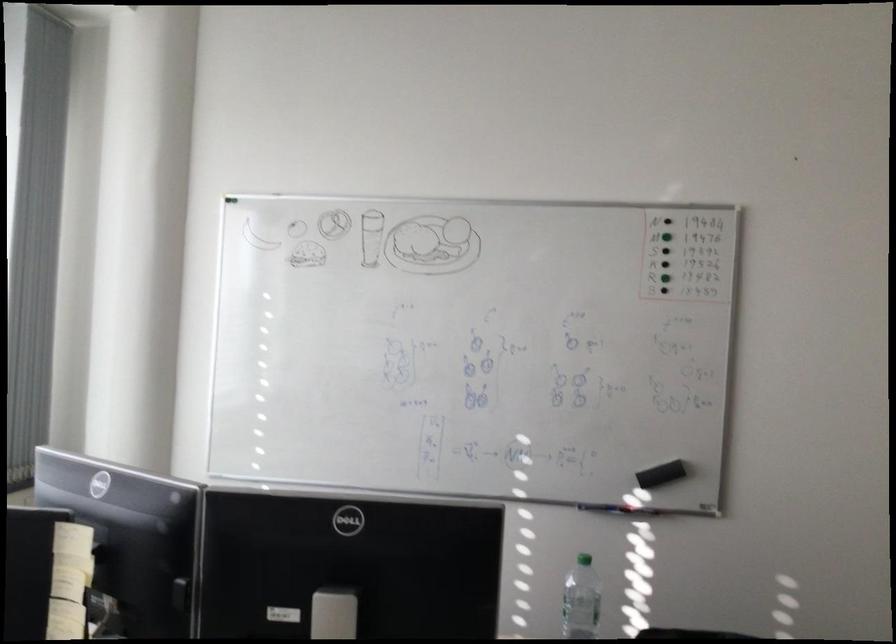
Find where to grasp the black whiteboard eraser. Please return your answer as a coordinate pair (x, y).

(661, 474)